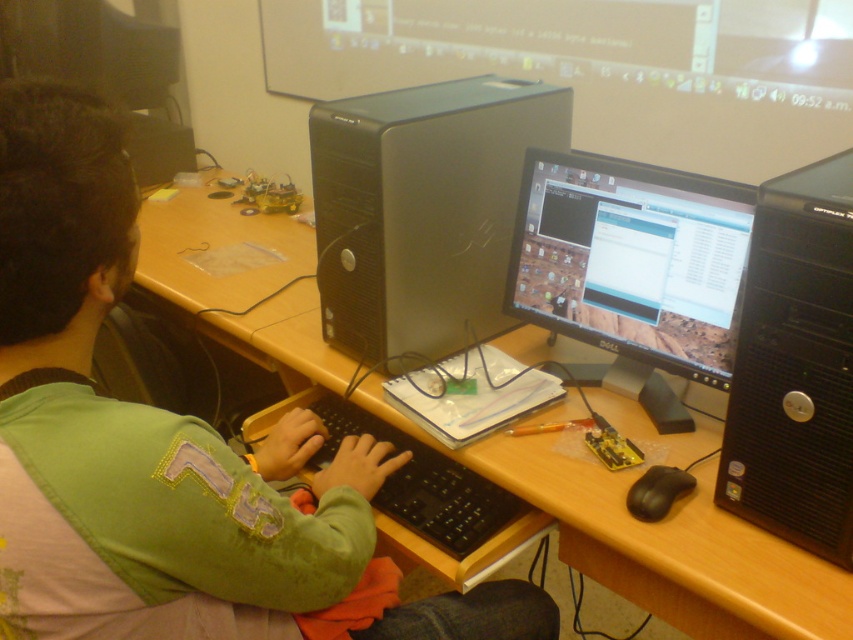
Question: Is satin black tower at center smaller than matte black monitor at center?

Choices:
 (A) no
 (B) yes

Answer: (A)

Question: Does black plastic tower at right appear over black plastic keyboard at center?

Choices:
 (A) no
 (B) yes

Answer: (B)

Question: Which point is closer to the camera taking this photo?

Choices:
 (A) (509, 508)
 (B) (24, 376)

Answer: (B)

Question: Observing the image, what is the correct spatial positioning of satin black tower at center in reference to black plastic keyboard at center?

Choices:
 (A) above
 (B) below

Answer: (A)

Question: Which point is closer to the camera?

Choices:
 (A) wooden at center
 (B) matte black monitor at center

Answer: (A)

Question: Which object appears closest to the camera in this image?

Choices:
 (A) matte black monitor at center
 (B) satin black tower at center
 (C) wooden at center
 (D) black plastic keyboard at center

Answer: (C)